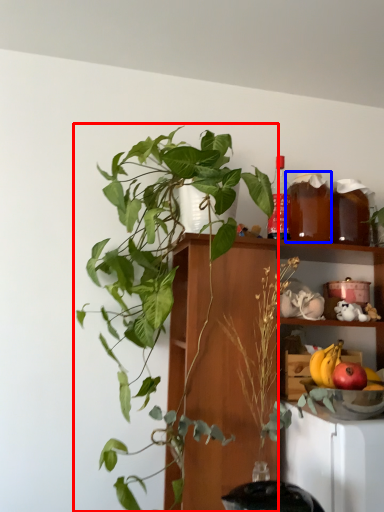
Question: Which object is closer to the camera taking this photo, houseplant (highlighted by a red box) or beverage (highlighted by a blue box)?

Choices:
 (A) houseplant
 (B) beverage

Answer: (A)